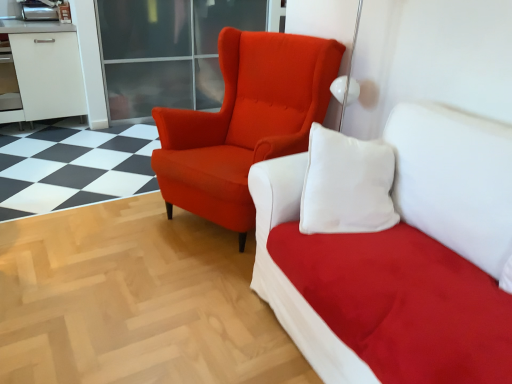
This screenshot has width=512, height=384. What are the coordinates of `matte orange armchair at center` in the screenshot? It's located at (244, 123).

Where is `suede white studio couch at upper center`? The image size is (512, 384). suede white studio couch at upper center is located at coordinates (455, 179).

Where is `matte orange armchair at center`? The width and height of the screenshot is (512, 384). matte orange armchair at center is located at coordinates (244, 123).

Is matte orange armchair at center in front of or behind suede white studio couch at upper center in the image?

Visually, matte orange armchair at center is located behind suede white studio couch at upper center.

Measure the distance from matte orange armchair at center to suede white studio couch at upper center.

matte orange armchair at center and suede white studio couch at upper center are 33.88 inches apart from each other.

Does matte orange armchair at center touch suede white studio couch at upper center?

No, matte orange armchair at center is not next to suede white studio couch at upper center.

Which is correct: matte orange armchair at center is inside suede white studio couch at upper center, or outside of it?

matte orange armchair at center is not inside suede white studio couch at upper center, it's outside.

Considering the sizes of objects matte orange armchair at center and transparent glass door at upper center in the image provided, who is thinner, matte orange armchair at center or transparent glass door at upper center?

transparent glass door at upper center is thinner.

Considering the relative sizes of matte orange armchair at center and transparent glass door at upper center in the image provided, is matte orange armchair at center smaller than transparent glass door at upper center?

Correct, matte orange armchair at center occupies less space than transparent glass door at upper center.

Is matte orange armchair at center inside or outside of transparent glass door at upper center?

The correct answer is: outside.

From the image's perspective, who appears lower, matte orange armchair at center or transparent glass door at upper center?

matte orange armchair at center appears lower in the image.

Based on the photo, between suede white studio couch at upper center and matte orange armchair at center, which one has larger size?

With larger size is suede white studio couch at upper center.

Considering the positions of objects suede white studio couch at upper center and matte orange armchair at center in the image provided, who is more to the left, suede white studio couch at upper center or matte orange armchair at center?

Positioned to the left is matte orange armchair at center.

Which of these two, suede white studio couch at upper center or matte orange armchair at center, stands shorter?

suede white studio couch at upper center is shorter.

Considering the sizes of objects transparent glass door at upper center and matte orange armchair at center in the image provided, who is bigger, transparent glass door at upper center or matte orange armchair at center?

transparent glass door at upper center.

From the image's perspective, is transparent glass door at upper center under matte orange armchair at center?

No.

Can you tell me how much transparent glass door at upper center and matte orange armchair at center differ in facing direction?

62.5 degrees.

In the scene shown: Which is less distant, (139, 49) or (209, 178)?

The point (209, 178) is more forward.

Does suede white studio couch at upper center have a larger size compared to transparent glass door at upper center?

Incorrect, suede white studio couch at upper center is not larger than transparent glass door at upper center.

Considering the sizes of objects suede white studio couch at upper center and transparent glass door at upper center in the image provided, who is thinner, suede white studio couch at upper center or transparent glass door at upper center?

transparent glass door at upper center.

Does suede white studio couch at upper center contain transparent glass door at upper center?

Actually, transparent glass door at upper center is outside suede white studio couch at upper center.

Which is nearer, [243,27] or [283,163]?

Point [243,27] is positioned farther from the camera compared to point [283,163].

Considering the sizes of objects transparent glass door at upper center and suede white studio couch at upper center in the image provided, who is wider, transparent glass door at upper center or suede white studio couch at upper center?

suede white studio couch at upper center.

From a real-world perspective, which is physically below, transparent glass door at upper center or suede white studio couch at upper center?

suede white studio couch at upper center.

Which object is closer to the camera, transparent glass door at upper center or suede white studio couch at upper center?

suede white studio couch at upper center is closer to the camera.

Find the location of a particular element. studio couch below the matte orange armchair at center (from a real-world perspective) is located at coordinates (455, 179).

The width and height of the screenshot is (512, 384). What are the coordinates of `glass door on the left of matte orange armchair at center` in the screenshot? It's located at pyautogui.click(x=168, y=51).

Based on their spatial positions, is suede white studio couch at upper center or matte orange armchair at center closer to transparent glass door at upper center?

matte orange armchair at center.

When comparing their distances from matte orange armchair at center, does transparent glass door at upper center or suede white studio couch at upper center seem further?

Based on the image, transparent glass door at upper center appears to be further to matte orange armchair at center.

From the picture: Looking at the image, which one is located further to suede white studio couch at upper center, matte orange armchair at center or transparent glass door at upper center?

transparent glass door at upper center is further to suede white studio couch at upper center.

Considering their positions, is transparent glass door at upper center positioned further to suede white studio couch at upper center than matte orange armchair at center?

transparent glass door at upper center is further to suede white studio couch at upper center.

When comparing their distances from transparent glass door at upper center, does matte orange armchair at center or suede white studio couch at upper center seem closer?

Among the two, matte orange armchair at center is located nearer to transparent glass door at upper center.

In the scene shown: From the image, which object appears to be farther from matte orange armchair at center, suede white studio couch at upper center or transparent glass door at upper center?

Based on the image, transparent glass door at upper center appears to be further to matte orange armchair at center.

Locate an element on the screen. chair located between suede white studio couch at upper center and transparent glass door at upper center in the depth direction is located at coordinates (244, 123).